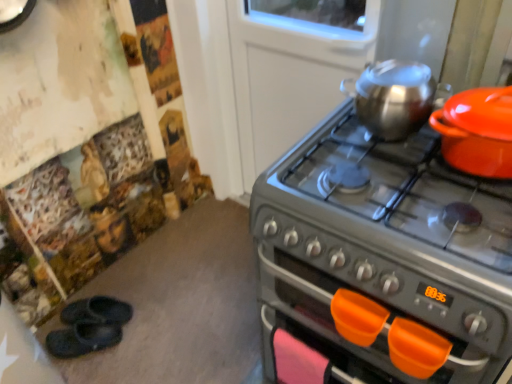
Question: From their relative heights in the image, would you say orange plastic handle at lower center is taller or shorter than black rubber slippers at lower left, which is the 1th footwear from back to front?

Choices:
 (A) tall
 (B) short

Answer: (A)

Question: Do you think orange plastic handle at lower center is within black rubber slippers at lower left, which is the 1th footwear from back to front, or outside of it?

Choices:
 (A) inside
 (B) outside

Answer: (B)

Question: Estimate the real-world distances between objects in this image. Which object is farther from the shiny metallic kettle at upper right, the 1th kitchen appliance in the left-to-right sequence?

Choices:
 (A) orange plastic handle at lower center
 (B) black rubber slippers at lower left, which is the 1th footwear from back to front
 (C) matte orange pot at right, the 1th kitchen appliance positioned from the right
 (D) black rubber slippers at lower left, marked as the 1th footwear in a front-to-back arrangement
 (E) metallic gray gas stove at right

Answer: (D)

Question: Based on their relative distances, which object is farther from the black rubber slippers at lower left, the second footwear in the back-to-front sequence?

Choices:
 (A) orange plastic handle at lower center
 (B) matte orange pot at right, the 1th kitchen appliance positioned from the right
 (C) black rubber slippers at lower left, which appears as the 2th footwear when viewed from the front
 (D) metallic gray gas stove at right
 (E) shiny metallic kettle at upper right, the 1th kitchen appliance in the left-to-right sequence

Answer: (B)